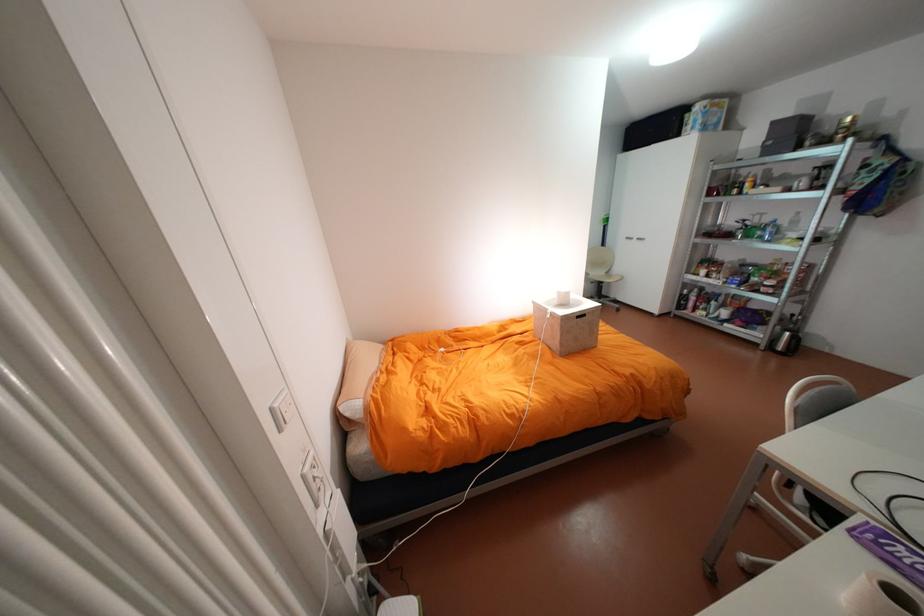
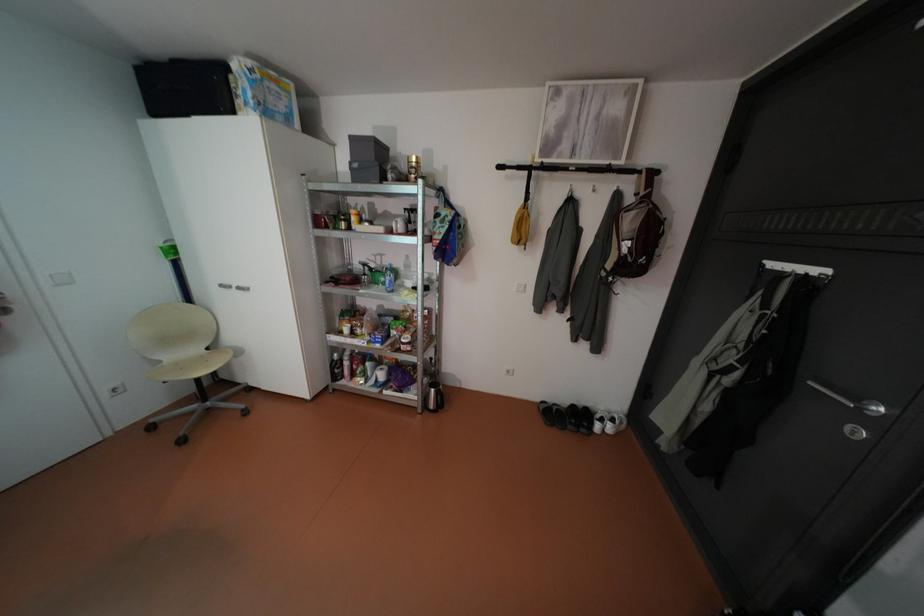
Where in the second image is the point corresponding to [779,142] from the first image?

(365, 164)